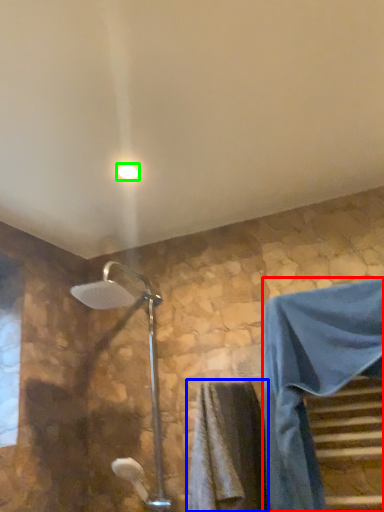
Question: Based on their relative distances, which object is farther from robe (highlighted by a red box)? Choose from bath towel (highlighted by a blue box) and light fixture (highlighted by a green box).

Choices:
 (A) bath towel
 (B) light fixture

Answer: (B)